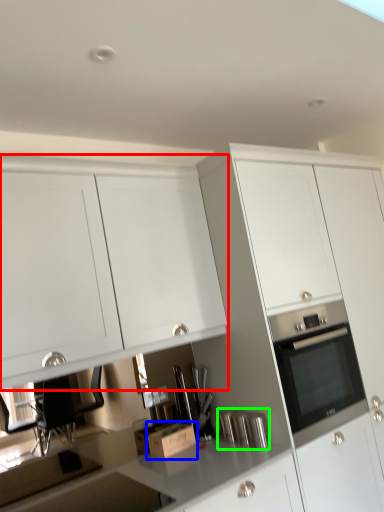
Question: Considering the real-world distances, which object is closest to cabinetry (highlighted by a red box)? cardboard box (highlighted by a blue box) or appliance (highlighted by a green box).

Choices:
 (A) cardboard box
 (B) appliance

Answer: (A)